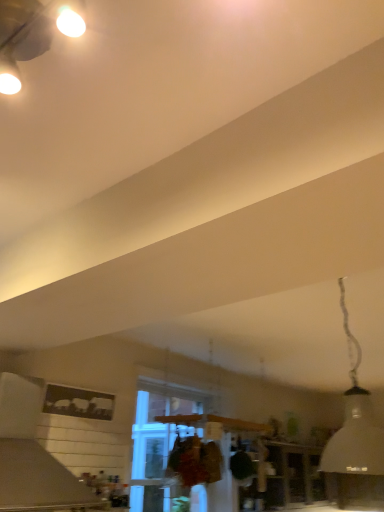
Describe the element at coordinates (158, 441) in the screenshot. This screenshot has height=512, width=384. I see `clear glass window at center` at that location.

What do you see at coordinates (32, 455) in the screenshot? I see `white matte vent at upper left` at bounding box center [32, 455].

At what (x,y) coordinates should I click in order to perform the action: click on clear glass window at center. Please return your answer as a coordinate pair (x, y). The image size is (384, 512). Looking at the image, I should click on (158, 441).

From the picture: From a real-world perspective, between white matte lampshade at upper right and white matte vent at upper left, who is vertically higher?

In real-world perspective, white matte lampshade at upper right is above.

Is white matte lampshade at upper right turned away from white matte vent at upper left?

No, white matte lampshade at upper right is not facing the opposite direction of white matte vent at upper left.

Is point (350, 359) positioned behind point (23, 397)?

Yes, point (350, 359) is behind point (23, 397).

Which is behind, white matte lampshade at upper right or white matte vent at upper left?

Positioned behind is white matte vent at upper left.

Which is more to the left, white matte vent at upper left or clear glass window at center?

white matte vent at upper left.

From a real-world perspective, is white matte vent at upper left under clear glass window at center?

Yes.

Do you think white matte vent at upper left is within clear glass window at center, or outside of it?

white matte vent at upper left is not inside clear glass window at center, it's outside.

Looking at this image, is clear glass window at center beside white matte lampshade at upper right?

clear glass window at center and white matte lampshade at upper right are clearly separated.

Does clear glass window at center contain white matte lampshade at upper right?

No, clear glass window at center does not contain white matte lampshade at upper right.

Find the location of `window beneath the white matte lampshade at upper right (from a real-world perspective)`. window beneath the white matte lampshade at upper right (from a real-world perspective) is located at coordinates (158, 441).

How far apart are clear glass window at center and white matte lampshade at upper right?

1.75 meters.

You are a GUI agent. You are given a task and a screenshot of the screen. Output one action in this format:
    pyautogui.click(x=<x>, y=<y>)
    Task: Click on the vent located behind the white matte lampshade at upper right
    Image resolution: width=384 pixels, height=512 pixels.
    Given the screenshot: What is the action you would take?
    pyautogui.click(x=32, y=455)

How much distance is there between white matte vent at upper left and white matte lampshade at upper right?

white matte vent at upper left is 1.98 meters away from white matte lampshade at upper right.

Does white matte vent at upper left have a lesser width compared to white matte lampshade at upper right?

No.

Consider the image. Considering the positions of objects white matte vent at upper left and white matte lampshade at upper right in the image provided, who is behind, white matte vent at upper left or white matte lampshade at upper right?

white matte vent at upper left is behind.

Which of these two, white matte lampshade at upper right or clear glass window at center, is wider?

white matte lampshade at upper right.

Considering the relative sizes of white matte lampshade at upper right and clear glass window at center in the image provided, is white matte lampshade at upper right taller than clear glass window at center?

In fact, white matte lampshade at upper right may be shorter than clear glass window at center.

Can you confirm if white matte lampshade at upper right is bigger than clear glass window at center?

Actually, white matte lampshade at upper right might be smaller than clear glass window at center.

Is white matte lampshade at upper right to the right of clear glass window at center from the viewer's perspective?

Indeed, white matte lampshade at upper right is positioned on the right side of clear glass window at center.

Is clear glass window at center touching white matte vent at upper left?

No, clear glass window at center is not with white matte vent at upper left.

Which object is positioned more to the left, clear glass window at center or white matte vent at upper left?

Positioned to the left is white matte vent at upper left.

Locate an element on the screen. This screenshot has width=384, height=512. window above the white matte vent at upper left (from a real-world perspective) is located at coordinates (158, 441).

Measure the distance from clear glass window at center to white matte vent at upper left.

clear glass window at center and white matte vent at upper left are 3.89 feet apart.

I want to click on vent located on the left of white matte lampshade at upper right, so click(32, 455).

Find the location of a particular element. This screenshot has width=384, height=512. window lying below the white matte vent at upper left (from the image's perspective) is located at coordinates [158, 441].

Considering their positions, is white matte vent at upper left positioned closer to clear glass window at center than white matte lampshade at upper right?

white matte vent at upper left lies closer to clear glass window at center than the other object.

Estimate the real-world distances between objects in this image. Which object is closer to white matte lampshade at upper right, clear glass window at center or white matte vent at upper left?

Among the two, clear glass window at center is located nearer to white matte lampshade at upper right.

When comparing their distances from white matte lampshade at upper right, does white matte vent at upper left or clear glass window at center seem further?

white matte vent at upper left lies further to white matte lampshade at upper right than the other object.

Estimate the real-world distances between objects in this image. Which object is closer to white matte vent at upper left, white matte lampshade at upper right or clear glass window at center?

Based on the image, clear glass window at center appears to be nearer to white matte vent at upper left.

Which object lies further to the anchor point white matte vent at upper left, clear glass window at center or white matte lampshade at upper right?

white matte lampshade at upper right.

Looking at the image, which one is located further to clear glass window at center, white matte lampshade at upper right or white matte vent at upper left?

Based on the image, white matte lampshade at upper right appears to be further to clear glass window at center.

Locate an element on the screen. Image resolution: width=384 pixels, height=512 pixels. window between white matte vent at upper left and white matte lampshade at upper right from left to right is located at coordinates (158, 441).